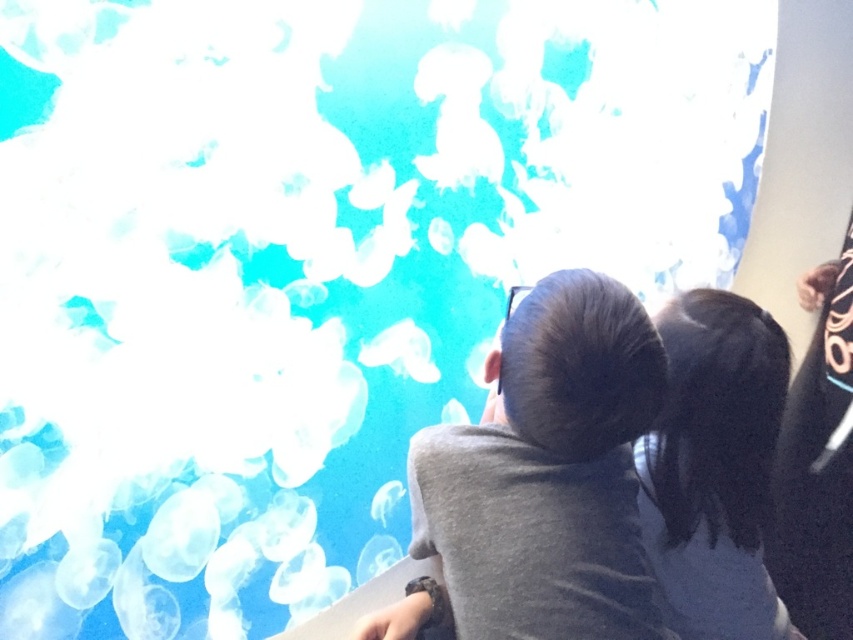
You are standing in the aquarium and see the gray matte shirt at center and the black hair at upper right. Which object is located lower in the image?

The gray matte shirt at center is positioned under black hair at upper right, so the gray matte shirt at center is lower in the image.

You are standing in the aquarium and want to take a photo of the two points marked in the scene. Which point, point (631, 522) or point (728, 545), would appear larger in your camera view?

Point (631, 522) is closer to the camera than point (728, 545), so it would appear larger in the camera view.

You are a photographer trying to capture a clear photo of the gray matte shirt at center and the black hair at upper right. Which object should you focus on first if you want to ensure both are in focus?

The gray matte shirt at center is larger than the black hair at upper right, so focusing on the larger object first will help ensure both are in focus.